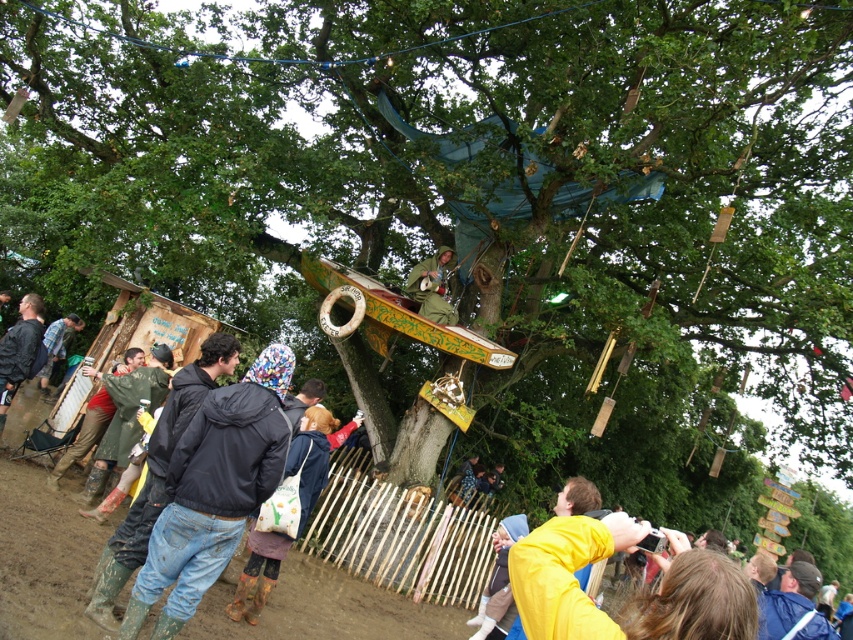
Between wet rubber boots at lower left and black matte jacket at left, which one appears on the left side from the viewer's perspective?

black matte jacket at left

Identify the location of wet rubber boots at lower left. (213, 490).

In the scene shown: Who is shorter, denim jacket at lower left or green matte jacket at center?

green matte jacket at center

Which is in front, point (299, 461) or point (436, 256)?

Point (299, 461) is in front.

Where is `denim jacket at lower left`? denim jacket at lower left is located at coordinates (310, 458).

Which is more to the right, rubber boots at lower left or wooden at center?

wooden at center

Who is taller, rubber boots at lower left or wooden at center?

rubber boots at lower left

Who is more distant from viewer, (25, 600) or (415, 579)?

Point (415, 579)

The height and width of the screenshot is (640, 853). Identify the location of rubber boots at lower left. (x=45, y=554).